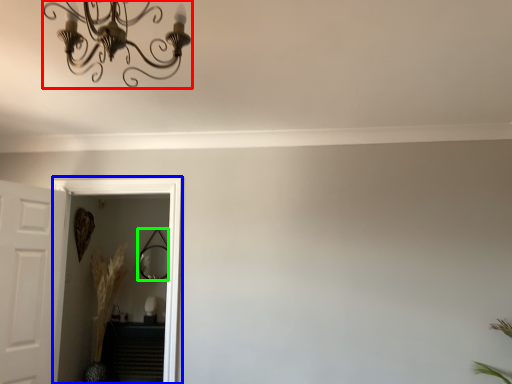
Question: Estimate the real-world distances between objects in this image. Which object is farther from light fixture (highlighted by a red box), glass door (highlighted by a blue box) or mirror (highlighted by a green box)?

Choices:
 (A) glass door
 (B) mirror

Answer: (B)